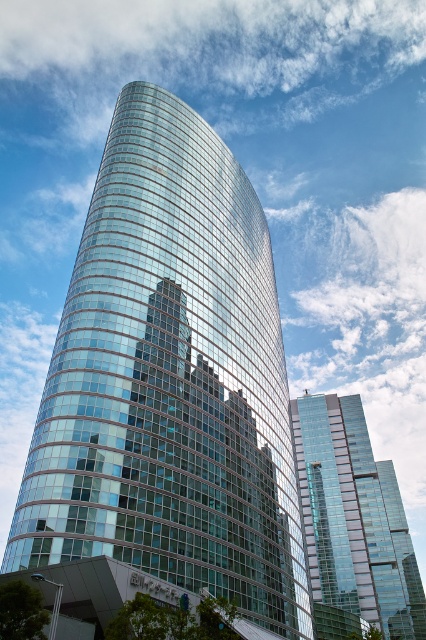
You are an architect reviewing a city model. You see the transparent glass tower at center and the transparent glass skyscraper at center. Which one is positioned more to the left?

The transparent glass tower at center is positioned more to the left than the transparent glass skyscraper at center.

Looking at this image, you are an urban planner reviewing the architectural plans. The city requires all new buildings to be at least 500 meters tall. Based on the image, can you determine if the transparent glass tower at center and the transparent glass skyscraper at center meet this requirement?

The transparent glass tower at center has a lesser height compared to transparent glass skyscraper at center. However, without knowing the exact height of either building, it is impossible to confirm if they meet the 500 meter requirement.

You are a drone operator tasked with flying a drone between the transparent glass tower at center and the transparent glass skyscraper at center. The drone has a wingspan of 1.2 meters. Can the drone safely navigate the space between them?

The distance between the transparent glass tower at center and the transparent glass skyscraper at center is 71.72 meters. Since the drone has a wingspan of 1.2 meters, it can easily navigate the space between them as the distance is significantly larger than the drone size.